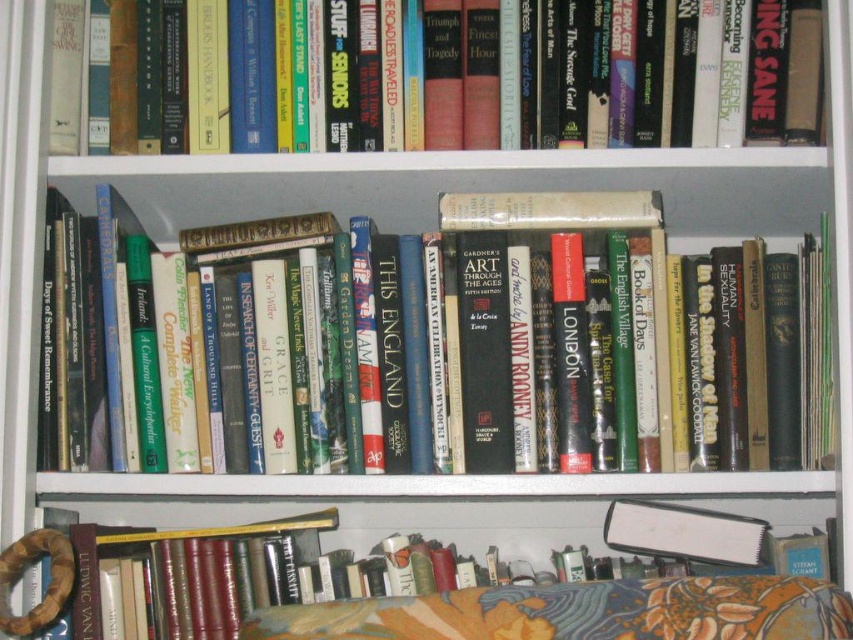
You are organizing books on a bookshelf. You have two books to place next to each other. The first is a hardcover books at center and the second is a hardcover book at lower center. Which book has a wider spine?

The hardcover books at center has a wider spine than the hardcover book at lower center because the hardcover books at center surpass the hardcover book at lower center in width.

You are a librarian who needs to place a new book that is 15 inches tall. You see the hardcover book at upper center and the hardcover book at lower center. Can you fit the new book vertically between these two books?

The distance between the hardcover book at upper center and the hardcover book at lower center is 16.73 inches. Since the new book is 15 inches tall, it can fit vertically between them as there is enough space.

From the picture: You are organizing books on a bookshelf and see the hardcover books at center and the hardcover book at lower center. Which one is located to the right of the other?

The hardcover books at center is positioned on the right side of hardcover book at lower center.